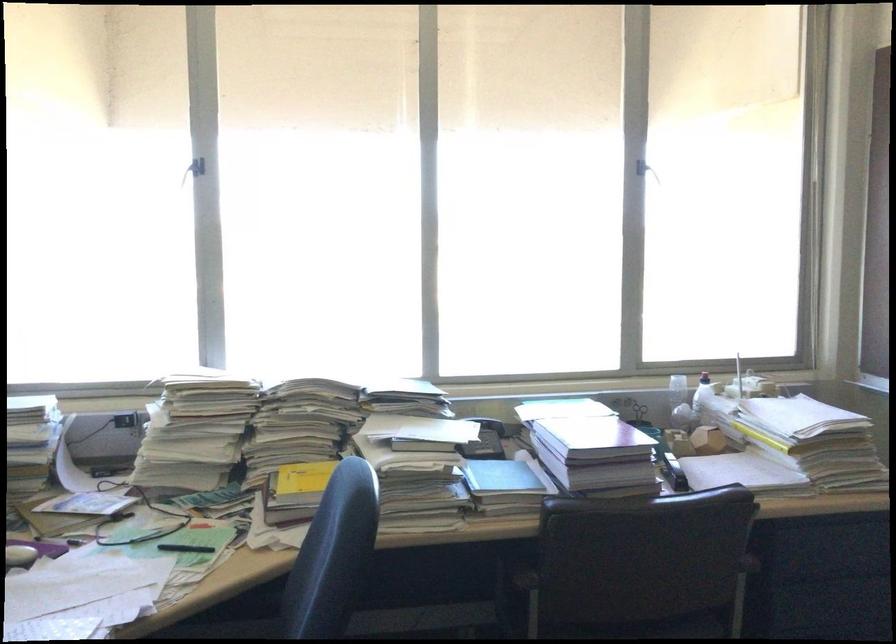
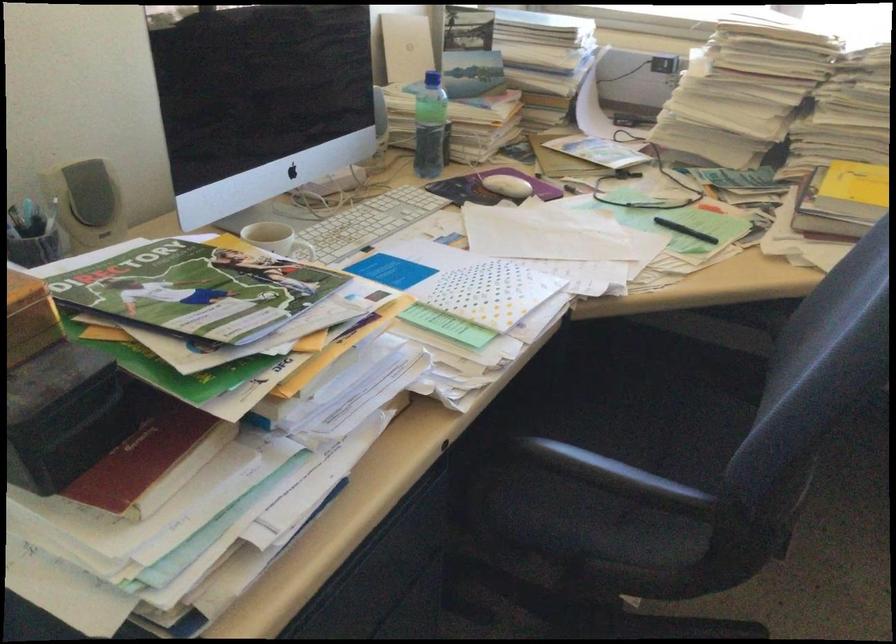
Where in the second image is the point corresponding to the point at 303,487 from the first image?

(853, 194)